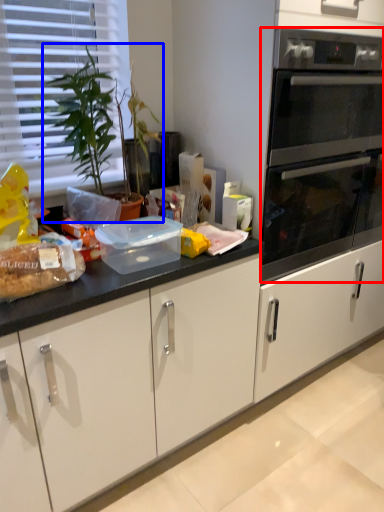
Question: Which object is closer to the camera taking this photo, oven (highlighted by a red box) or houseplant (highlighted by a blue box)?

Choices:
 (A) oven
 (B) houseplant

Answer: (B)